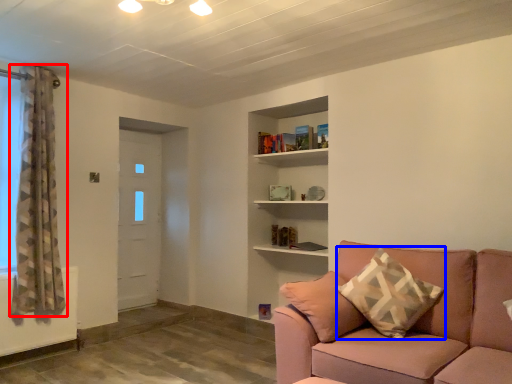
Question: Which point is closer to the camera, curtain (highlighted by a red box) or pillow (highlighted by a blue box)?

Choices:
 (A) curtain
 (B) pillow

Answer: (B)